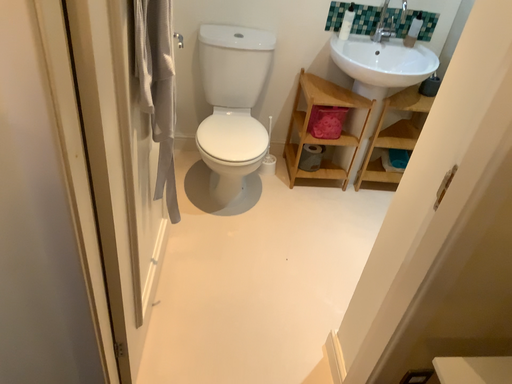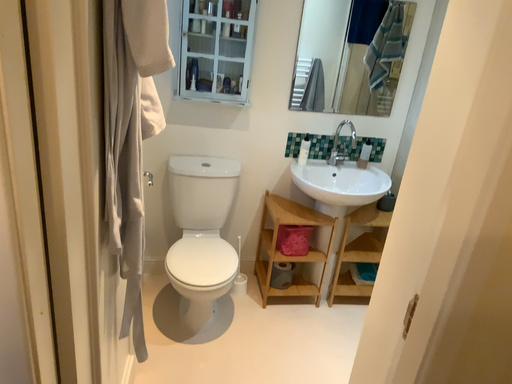
Question: How did the camera likely rotate when shooting the video?

Choices:
 (A) rotated downward
 (B) rotated upward

Answer: (B)